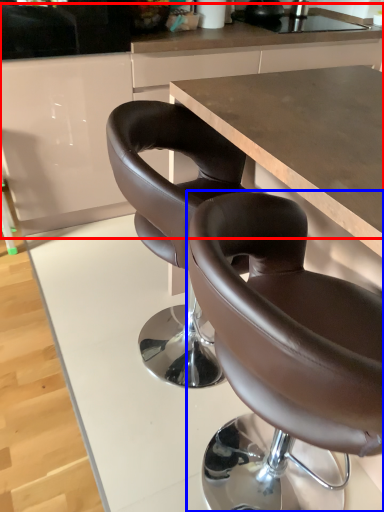
Question: Which object appears farthest to the camera in this image, counter (highlighted by a red box) or chair (highlighted by a blue box)?

Choices:
 (A) counter
 (B) chair

Answer: (A)